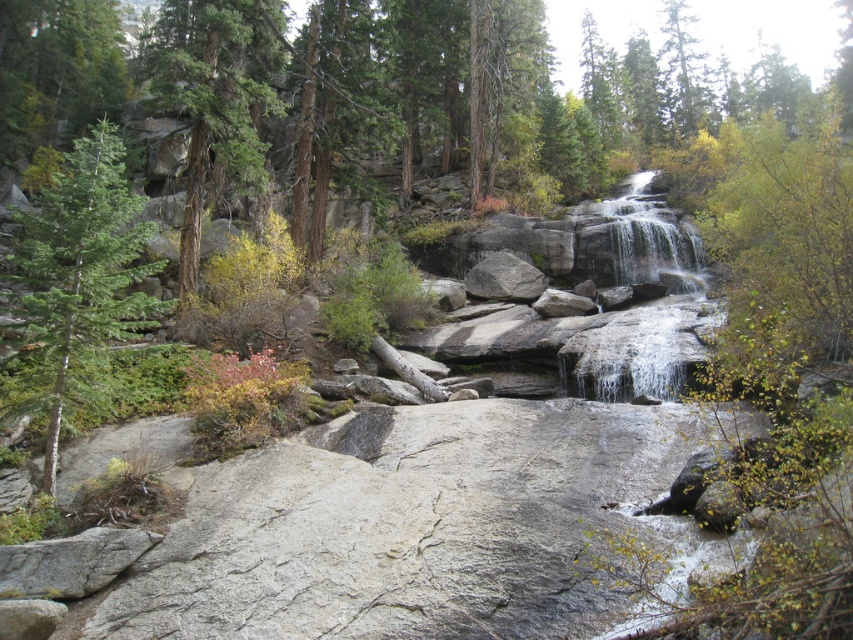
Question: Which point is closer to the camera?

Choices:
 (A) (509, 284)
 (B) (212, 154)
 (C) (692, 74)

Answer: (A)

Question: Does green matte tree at left appear on the left side of gray rough rock at center?

Choices:
 (A) yes
 (B) no

Answer: (A)

Question: Does green matte tree at left appear over gray rough rock at center?

Choices:
 (A) no
 (B) yes

Answer: (B)

Question: Which is nearer to the gray rough rock at center?

Choices:
 (A) green textured tree at left
 (B) green textured tree at upper center
 (C) green matte tree at left

Answer: (A)

Question: Estimate the real-world distances between objects in this image. Which object is closer to the green textured tree at upper center?

Choices:
 (A) green textured tree at left
 (B) green matte tree at left
 (C) gray rough rock at center

Answer: (C)

Question: Can you confirm if green textured tree at upper center is positioned above gray rough rock at center?

Choices:
 (A) yes
 (B) no

Answer: (A)